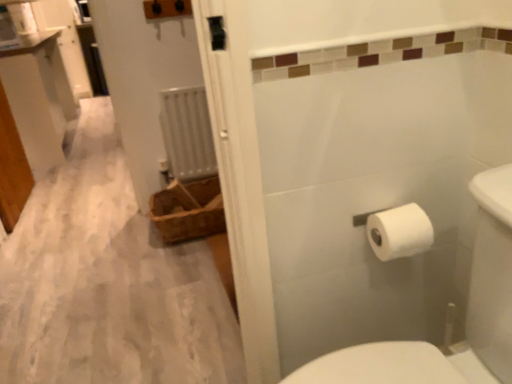
Question: Is the depth of white matte toilet paper at right less than that of white glossy vanity at upper left?

Choices:
 (A) yes
 (B) no

Answer: (A)

Question: Can you confirm if white matte toilet paper at right is positioned to the right of white glossy vanity at upper left?

Choices:
 (A) no
 (B) yes

Answer: (B)

Question: Can you confirm if white matte toilet paper at right is thinner than white glossy vanity at upper left?

Choices:
 (A) no
 (B) yes

Answer: (B)

Question: From the image's perspective, is white matte toilet paper at right on top of white glossy vanity at upper left?

Choices:
 (A) no
 (B) yes

Answer: (A)

Question: Does white matte toilet paper at right come behind white glossy vanity at upper left?

Choices:
 (A) no
 (B) yes

Answer: (A)

Question: From a real-world perspective, is white glossy vanity at upper left positioned above or below brown woven basket at left?

Choices:
 (A) below
 (B) above

Answer: (B)

Question: Is point (13, 225) closer or farther from the camera than point (195, 206)?

Choices:
 (A) farther
 (B) closer

Answer: (A)

Question: Is white glossy vanity at upper left in front of or behind brown woven basket at left in the image?

Choices:
 (A) front
 (B) behind

Answer: (B)

Question: From the image's perspective, is white glossy vanity at upper left above or below brown woven basket at left?

Choices:
 (A) below
 (B) above

Answer: (B)

Question: Is brown woven basket at left taller or shorter than white metallic radiator at center?

Choices:
 (A) short
 (B) tall

Answer: (A)

Question: From a real-world perspective, relative to white metallic radiator at center, is brown woven basket at left vertically above or below?

Choices:
 (A) below
 (B) above

Answer: (A)

Question: Considering the relative positions of brown woven basket at left and white metallic radiator at center in the image provided, is brown woven basket at left to the left or to the right of white metallic radiator at center?

Choices:
 (A) right
 (B) left

Answer: (A)

Question: From the image's perspective, relative to white metallic radiator at center, is brown woven basket at left above or below?

Choices:
 (A) below
 (B) above

Answer: (A)

Question: Considering the positions of white metallic radiator at center and white matte toilet paper at right in the image, is white metallic radiator at center bigger or smaller than white matte toilet paper at right?

Choices:
 (A) small
 (B) big

Answer: (B)

Question: Is white metallic radiator at center to the left or to the right of white matte toilet paper at right in the image?

Choices:
 (A) right
 (B) left

Answer: (B)